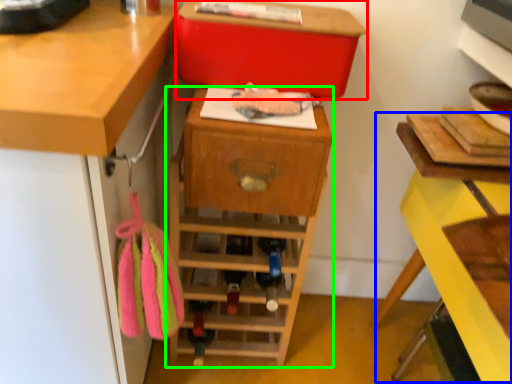
Question: Which is nearer to the storage box (highlighted by a red box)? computer desk (highlighted by a blue box) or shelf (highlighted by a green box).

Choices:
 (A) computer desk
 (B) shelf

Answer: (B)